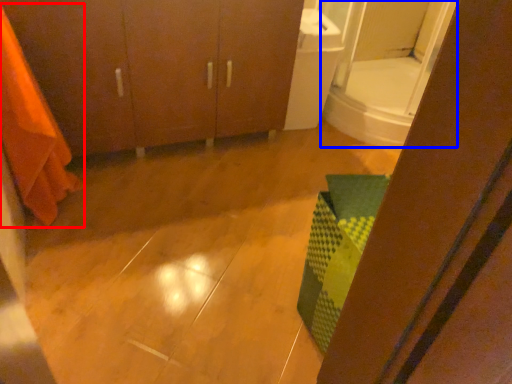
Question: Among these objects, which one is nearest to the camera, shower curtain (highlighted by a red box) or mirror (highlighted by a blue box)?

Choices:
 (A) shower curtain
 (B) mirror

Answer: (A)